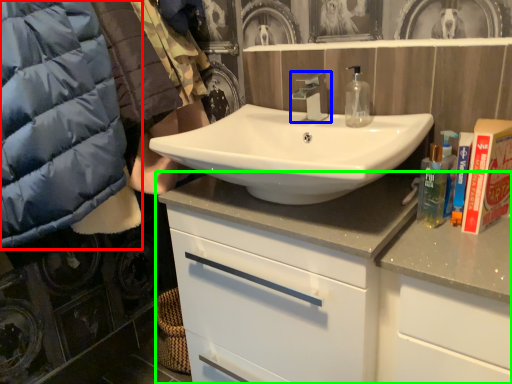
Question: Which object is positioned farthest from jacket (highlighted by a red box)? Select from tap (highlighted by a blue box) and bathroom cabinet (highlighted by a green box).

Choices:
 (A) tap
 (B) bathroom cabinet

Answer: (A)